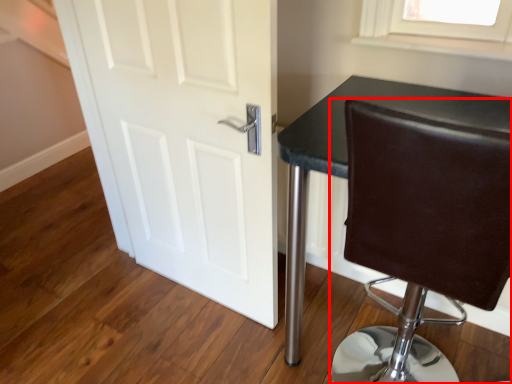
Question: From the image's perspective, where is chair (annotated by the red box) located relative to door?

Choices:
 (A) above
 (B) below

Answer: (B)